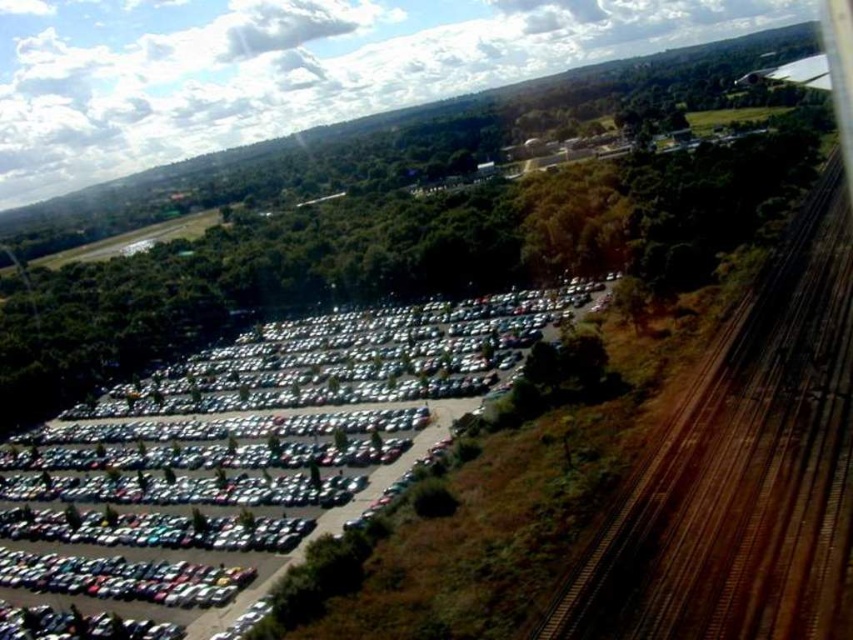
Between shiny metallic cars at center and brown wooden train tracks at right, which one has less height?

Standing shorter between the two is brown wooden train tracks at right.

Describe the element at coordinates (252, 452) in the screenshot. Image resolution: width=853 pixels, height=640 pixels. I see `shiny metallic cars at center` at that location.

Is point (107, 465) closer to viewer compared to point (761, 577)?

That is False.

Image resolution: width=853 pixels, height=640 pixels. I want to click on shiny metallic cars at center, so click(x=252, y=452).